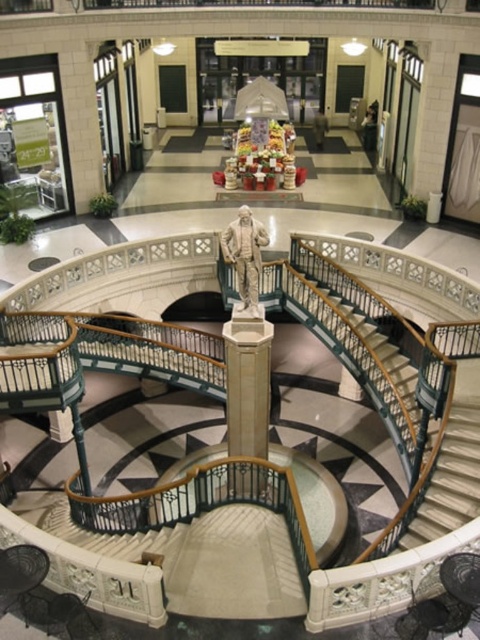
Question: In this image, where is white marble column at center located relative to white marble statue at center?

Choices:
 (A) below
 (B) above

Answer: (A)

Question: Which point appears closest to the camera in this image?

Choices:
 (A) (224, 250)
 (B) (242, 417)

Answer: (A)

Question: Does white marble column at center lie in front of white marble statue at center?

Choices:
 (A) yes
 (B) no

Answer: (B)

Question: Is white marble column at center closer to the viewer compared to white marble statue at center?

Choices:
 (A) no
 (B) yes

Answer: (A)